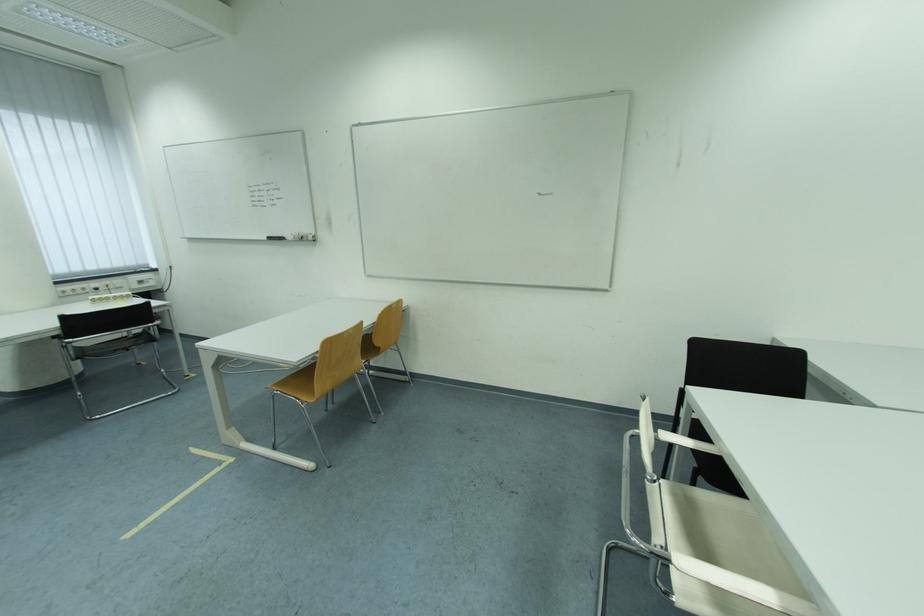
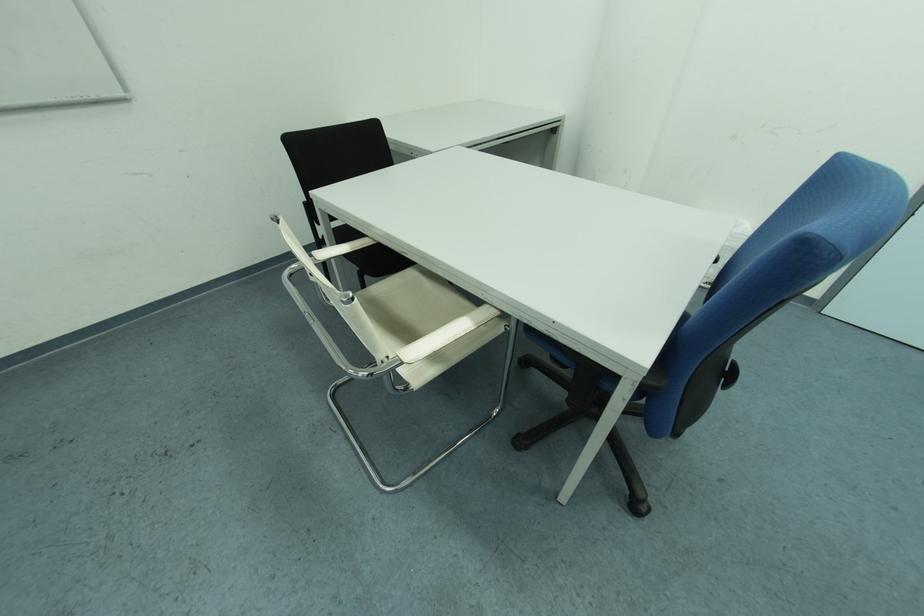
In the second image, find the point that corresponds to (x=675, y=439) in the first image.

(331, 257)